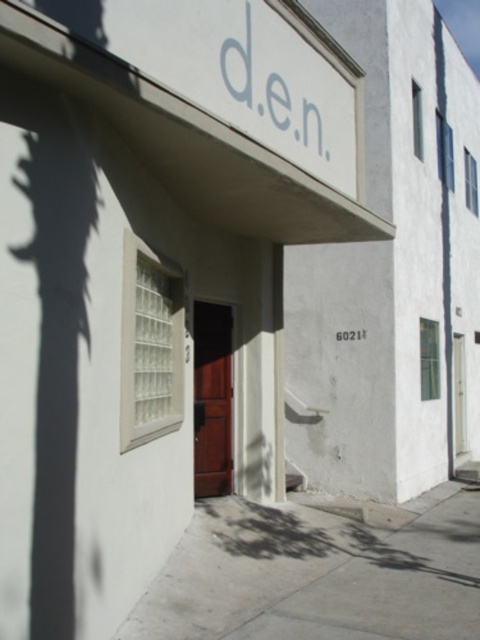
You are a delivery person trying to park your 1.5 meter wide delivery cart near the entrance. The gray concrete pavement at center and the brown wooden door at center are in your way. Which area can you park your cart without blocking the door?

The gray concrete pavement at center has a larger width than the brown wooden door at center, so you can park your delivery cart on the gray concrete pavement at center without blocking the door.

You are standing in front of the building and want to step onto the gray concrete pavement at center. Based on its location, can you determine if it is directly in front of the entrance or to the side?

The gray concrete pavement at center is located at point coordinates that place it centrally, so it is directly in front of the entrance.

You are standing in front of the building and need to walk to the brown wooden door at center. Which direction should you face to approach it from the gray concrete pavement at center?

The gray concrete pavement at center is in front of the brown wooden door at center, so you should face towards the brown wooden door at center while standing on the gray concrete pavement at center to approach it directly.